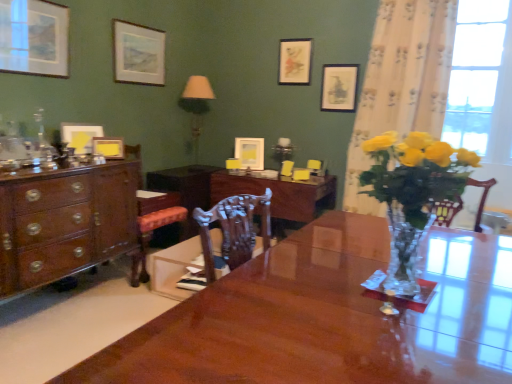
Question: From the image's perspective, is wooden armchair at center, which appears as the 2th armchair when viewed from the left, over translucent glass lamp at upper center?

Choices:
 (A) no
 (B) yes

Answer: (A)

Question: Can you confirm if wooden armchair at center, the 1th armchair positioned from the right, is wider than translucent glass lamp at upper center?

Choices:
 (A) yes
 (B) no

Answer: (B)

Question: Is wooden armchair at center, which appears as the 2th armchair when viewed from the left, to the right of translucent glass lamp at upper center from the viewer's perspective?

Choices:
 (A) no
 (B) yes

Answer: (B)

Question: Is translucent glass lamp at upper center surrounded by wooden armchair at center, which appears as the 2th armchair when viewed from the left?

Choices:
 (A) no
 (B) yes

Answer: (A)

Question: Is wooden armchair at center, the 1th armchair positioned from the right, in front of translucent glass lamp at upper center?

Choices:
 (A) no
 (B) yes

Answer: (B)

Question: Is wooden armchair at center, the 1th armchair positioned from the right, thinner than translucent glass lamp at upper center?

Choices:
 (A) yes
 (B) no

Answer: (A)

Question: Is there a large distance between translucent glass lamp at upper center and mahogany wood cabinet at center?

Choices:
 (A) no
 (B) yes

Answer: (A)

Question: Does translucent glass lamp at upper center have a smaller size compared to mahogany wood cabinet at center?

Choices:
 (A) no
 (B) yes

Answer: (B)

Question: Is translucent glass lamp at upper center shorter than mahogany wood cabinet at center?

Choices:
 (A) yes
 (B) no

Answer: (B)

Question: Is mahogany wood cabinet at center located within translucent glass lamp at upper center?

Choices:
 (A) no
 (B) yes

Answer: (A)

Question: Considering the relative positions of translucent glass lamp at upper center and mahogany wood cabinet at center in the image provided, is translucent glass lamp at upper center to the right of mahogany wood cabinet at center from the viewer's perspective?

Choices:
 (A) yes
 (B) no

Answer: (A)

Question: Does translucent glass lamp at upper center have a greater height compared to mahogany wood cabinet at center?

Choices:
 (A) no
 (B) yes

Answer: (B)

Question: Is matte paper picture frame at upper center, the 6th picture frame when ordered from left to right, smaller than glossy wood desk at center?

Choices:
 (A) no
 (B) yes

Answer: (B)